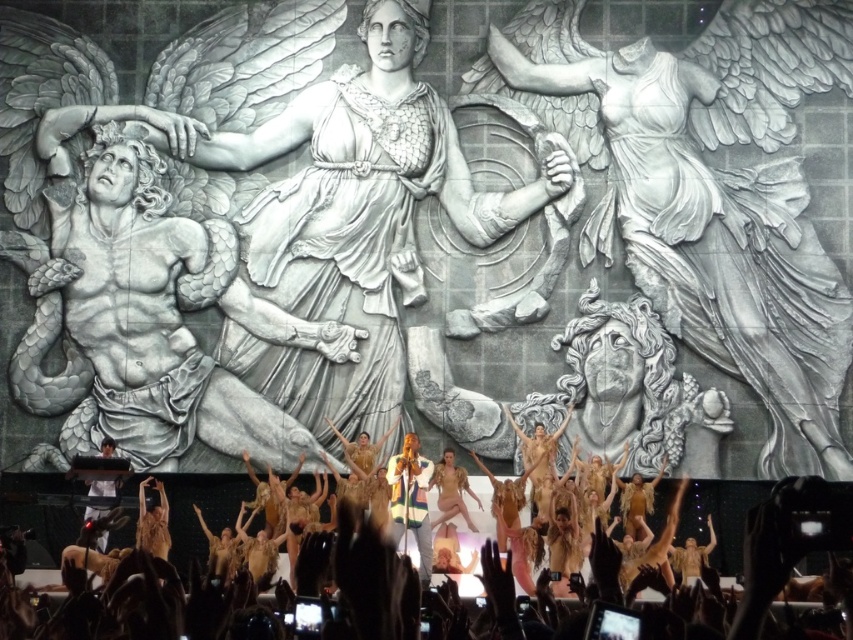
Is point (393, 372) positioned after point (132, 611)?

That is True.

Is point (399, 353) farther from camera compared to point (19, 621)?

Yes, it is.

At what (x,y) coordinates should I click in order to perform the action: click on white marble statue at center. Please return your answer as a coordinate pair (x, y). Looking at the image, I should click on (260, 257).

You are a GUI agent. You are given a task and a screenshot of the screen. Output one action in this format:
    pyautogui.click(x=<x>, y=<y>)
    Task: Click on the gray stone man at left
    
    Given the screenshot: What is the action you would take?
    pyautogui.click(x=149, y=323)

You are a GUI agent. You are given a task and a screenshot of the screen. Output one action in this format:
    pyautogui.click(x=<x>, y=<y>)
    Task: Click on the gray stone man at left
    The width and height of the screenshot is (853, 640).
    Given the screenshot: What is the action you would take?
    tap(149, 323)

From the picture: Does brown feathered costumes at lower center have a lesser width compared to white matte shirt at lower left?

Incorrect, brown feathered costumes at lower center's width is not less than white matte shirt at lower left's.

Who is more forward, (x=171, y=616) or (x=93, y=477)?

Positioned in front is point (x=171, y=616).

Who is more distant from viewer, (337, 634) or (97, 484)?

The point (97, 484) is behind.

Where is `brown feathered costumes at lower center`? brown feathered costumes at lower center is located at coordinates (151, 602).